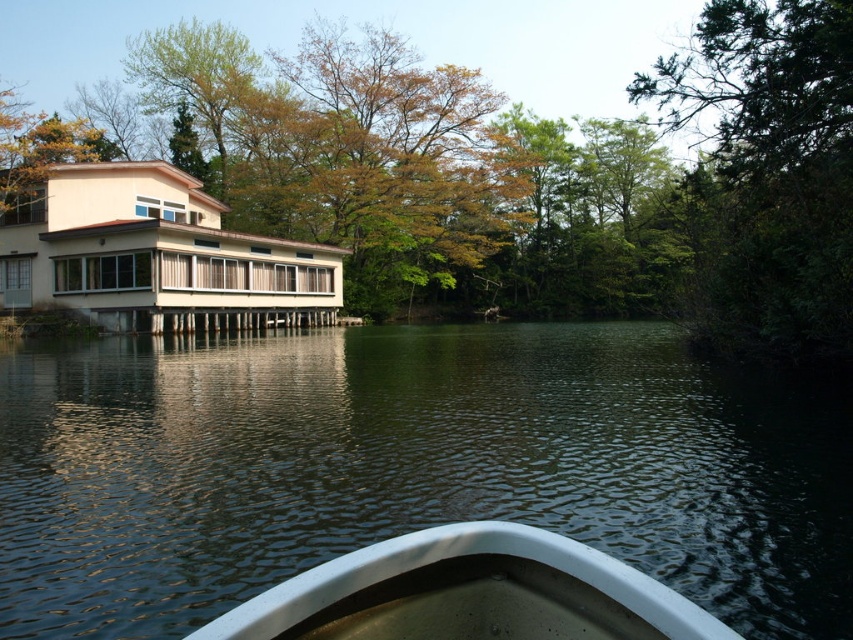
Question: Is greenish water at center to the right of green leafy tree at upper right from the viewer's perspective?

Choices:
 (A) no
 (B) yes

Answer: (A)

Question: Which point is closer to the camera taking this photo?

Choices:
 (A) (463, 413)
 (B) (495, 563)

Answer: (B)

Question: Is greenish water at center above green leafy tree at upper center?

Choices:
 (A) no
 (B) yes

Answer: (A)

Question: Among these objects, which one is nearest to the camera?

Choices:
 (A) white glossy boat at center
 (B) yellow-green foliage at upper left

Answer: (A)

Question: Is green leafy tree at upper right below white glossy boat at center?

Choices:
 (A) yes
 (B) no

Answer: (B)

Question: Which of the following is the farthest from the observer?

Choices:
 (A) white glossy boat at center
 (B) yellow-green foliage at upper left
 (C) green leafy tree at upper right

Answer: (B)